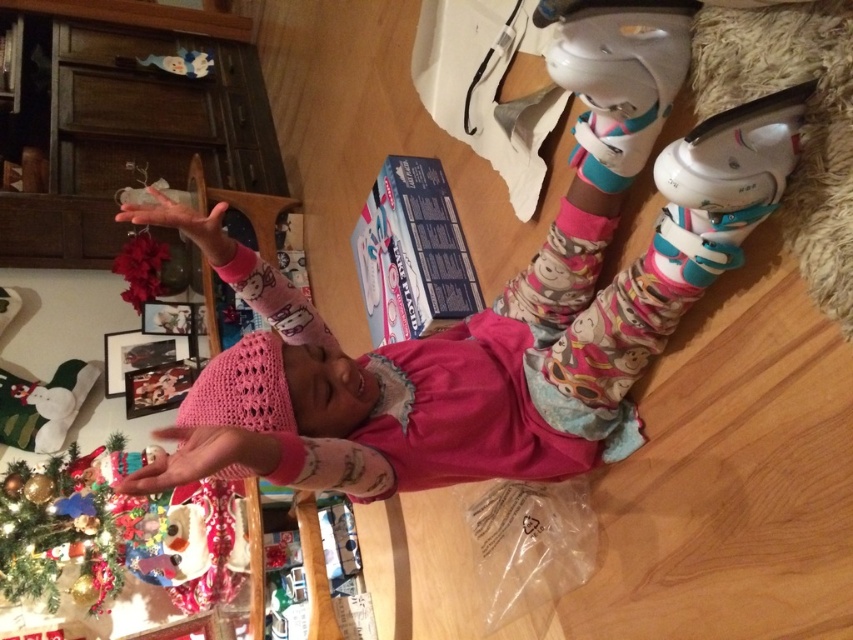
Does green matte christmas tree at lower left have a greater height compared to pink knitted sock at center?

Yes.

Is point (120, 444) closer to camera compared to point (334, 337)?

No, (120, 444) is further to viewer.

Where is `green matte christmas tree at lower left`? green matte christmas tree at lower left is located at coordinates (61, 529).

In the scene shown: Is pink knitted hat at upper center shorter than pink knitted sock at center?

No, pink knitted hat at upper center is not shorter than pink knitted sock at center.

Is pink knitted hat at upper center to the left of pink knitted sock at center from the viewer's perspective?

Incorrect, pink knitted hat at upper center is not on the left side of pink knitted sock at center.

I want to click on pink knitted hat at upper center, so click(x=517, y=301).

Does pink knitted hat at upper center have a greater width compared to green matte christmas tree at lower left?

Yes, pink knitted hat at upper center is wider than green matte christmas tree at lower left.

Is pink knitted hat at upper center to the right of green matte christmas tree at lower left from the viewer's perspective?

Yes, pink knitted hat at upper center is to the right of green matte christmas tree at lower left.

This screenshot has height=640, width=853. Find the location of `pink knitted hat at upper center`. pink knitted hat at upper center is located at coordinates (517, 301).